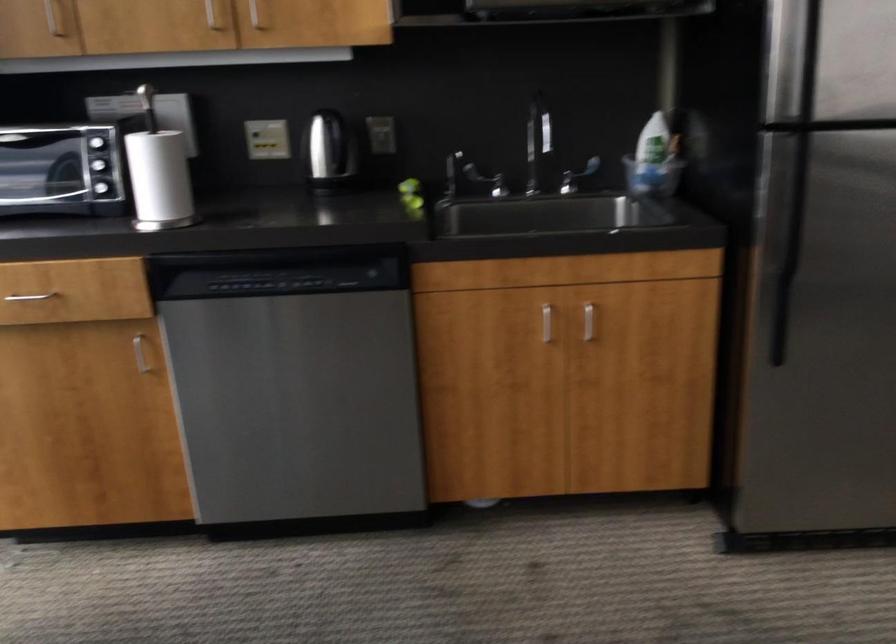
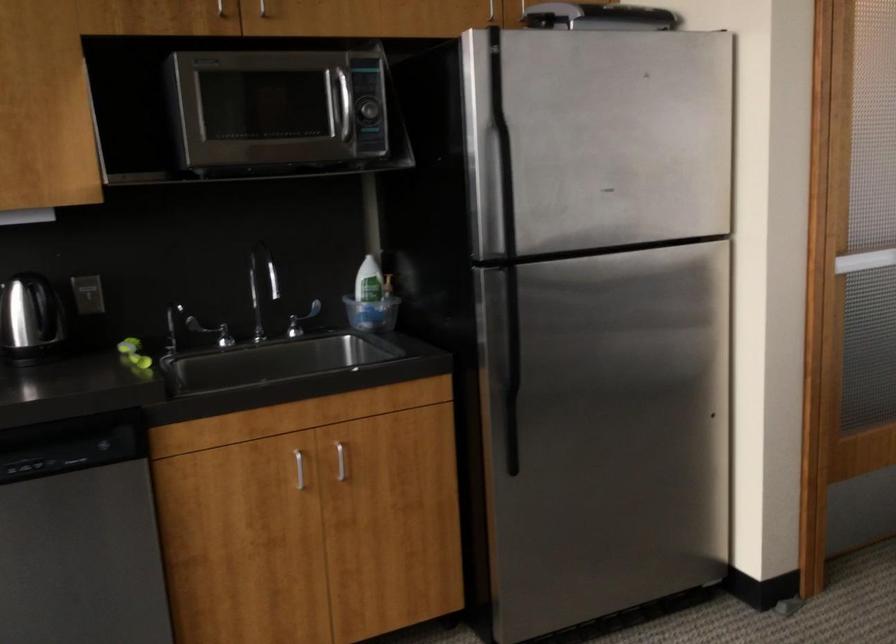
Question: The first image is from the beginning of the video and the second image is from the end. How did the camera likely rotate when shooting the video?

Choices:
 (A) Left
 (B) Right
 (C) Up
 (D) Down

Answer: (B)